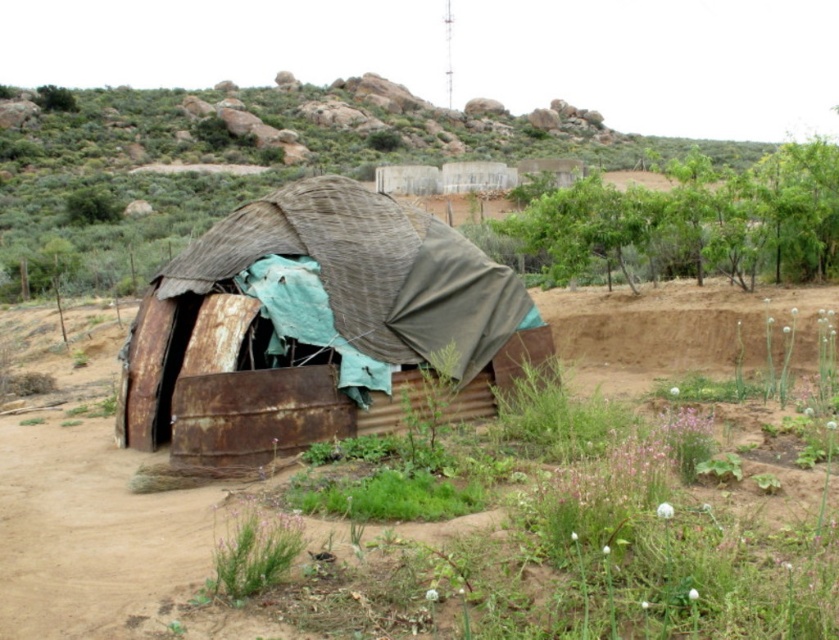
Question: Does rusty corrugated metal hut at center appear on the right side of green leafy plants at upper right?

Choices:
 (A) yes
 (B) no

Answer: (B)

Question: Can you confirm if rusty corrugated metal hut at center is positioned above green leafy plants at upper right?

Choices:
 (A) no
 (B) yes

Answer: (A)

Question: Considering the relative positions of rusty corrugated metal hut at center and green leafy plants at upper right in the image provided, where is rusty corrugated metal hut at center located with respect to green leafy plants at upper right?

Choices:
 (A) above
 (B) below

Answer: (B)

Question: Which point is farther to the camera?

Choices:
 (A) green leafy plants at upper right
 (B) rusty corrugated metal hut at center

Answer: (A)